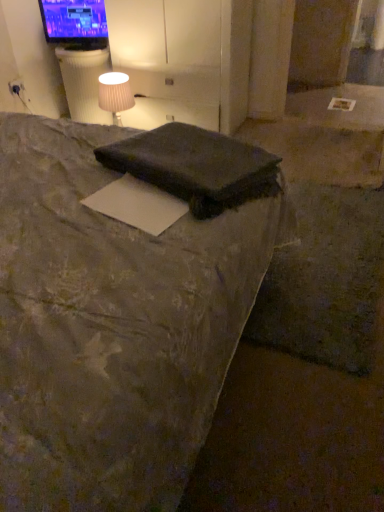
This screenshot has width=384, height=512. What do you see at coordinates (110, 328) in the screenshot? I see `dark gray fabric bed at center` at bounding box center [110, 328].

This screenshot has height=512, width=384. Find the location of `white ribbed table at upper left`. white ribbed table at upper left is located at coordinates pyautogui.click(x=84, y=82).

The height and width of the screenshot is (512, 384). Identify the location of dark gray fabric bed at center. (110, 328).

From the image's perspective, would you say dark gray fabric bed at center is positioned over white ribbed table at upper left?

Actually, dark gray fabric bed at center appears below white ribbed table at upper left in the image.

In terms of height, does dark gray fabric bed at center look taller or shorter compared to white ribbed table at upper left?

Clearly, dark gray fabric bed at center is taller compared to white ribbed table at upper left.

From a real-world perspective, which object rests below the other?

white ribbed table at upper left, from a real-world perspective.

In the image, there is a white matte paper at center. At what (x,y) coordinates should I click in order to perform the action: click on table above it (from the image's perspective). Please return your answer as a coordinate pair (x, y). Looking at the image, I should click on (84, 82).

How distant is white ribbed table at upper left from white matte paper at center?

white ribbed table at upper left and white matte paper at center are 2.12 meters apart.

Is white ribbed table at upper left further to camera compared to white matte paper at center?

Yes, it is.

Is matte white outlet at upper left beside matte white fabric at upper left?

No, matte white outlet at upper left is not making contact with matte white fabric at upper left.

From a real-world perspective, does matte white outlet at upper left stand above matte white fabric at upper left?

Yes, from a real-world perspective, matte white outlet at upper left is over matte white fabric at upper left

Which point is more forward, (13, 82) or (99, 81)?

Point (99, 81)

Is matte white outlet at upper left positioned with its back to matte white fabric at upper left?

matte white outlet at upper left does not have its back to matte white fabric at upper left.

Between point (80, 114) and point (47, 7), which one is positioned in front?

The point (47, 7) is closer to the camera.

Is white ribbed table at upper left spatially inside matte black tv at upper left, or outside of it?

white ribbed table at upper left is outside matte black tv at upper left.

Is white ribbed table at upper left to the left of matte black tv at upper left from the viewer's perspective?

Incorrect, white ribbed table at upper left is not on the left side of matte black tv at upper left.

Considering the relative positions of matte black tv at upper left and white matte paper at center in the image provided, is matte black tv at upper left to the right of white matte paper at center from the viewer's perspective?

In fact, matte black tv at upper left is to the left of white matte paper at center.

There is a white matte paper at center. Where is `television above it (from a real-world perspective)`? The height and width of the screenshot is (512, 384). television above it (from a real-world perspective) is located at coordinates (75, 23).

From a real-world perspective, does matte black tv at upper left sit lower than white matte paper at center?

Actually, matte black tv at upper left is physically above white matte paper at center in the real world.

Considering the relative sizes of dark gray fabric bed at center and white matte paper at center in the image provided, is dark gray fabric bed at center bigger than white matte paper at center?

Indeed, dark gray fabric bed at center has a larger size compared to white matte paper at center.

Are dark gray fabric bed at center and white matte paper at center making contact?

dark gray fabric bed at center is not next to white matte paper at center, and they're not touching.

Between dark gray fabric bed at center and white matte paper at center, which one appears on the right side from the viewer's perspective?

Positioned to the right is white matte paper at center.

Is dark gray fabric pillow at center bigger or smaller than dark gray fabric bed at center?

In the image, dark gray fabric pillow at center appears to be smaller than dark gray fabric bed at center.

Considering the relative positions of dark gray fabric pillow at center and dark gray fabric bed at center in the image provided, is dark gray fabric pillow at center to the left or to the right of dark gray fabric bed at center?

dark gray fabric pillow at center is positioned on dark gray fabric bed at center's right side.

Considering the positions of objects dark gray fabric pillow at center and dark gray fabric bed at center in the image provided, who is behind, dark gray fabric pillow at center or dark gray fabric bed at center?

Positioned behind is dark gray fabric pillow at center.

In terms of height, does dark gray fabric pillow at center look taller or shorter compared to dark gray fabric bed at center?

In the image, dark gray fabric pillow at center appears to be shorter than dark gray fabric bed at center.

You are a GUI agent. You are given a task and a screenshot of the screen. Output one action in this format:
    pyautogui.click(x=<x>, y=<y>)
    Task: Click on the bed lying below the white ribbed table at upper left (from the image's perspective)
    The height and width of the screenshot is (512, 384).
    Given the screenshot: What is the action you would take?
    pyautogui.click(x=110, y=328)

Locate an element on the screen. The width and height of the screenshot is (384, 512). paper on the right of white ribbed table at upper left is located at coordinates (137, 205).

Based on their spatial positions, is white matte paper at center or matte white fabric at upper left further from matte black tv at upper left?

white matte paper at center.

From the image, which object appears to be farther from matte white fabric at upper left, dark gray fabric pillow at center or matte black tv at upper left?

dark gray fabric pillow at center is further to matte white fabric at upper left.

Considering their positions, is matte white outlet at upper left positioned closer to white matte paper at center than dark gray fabric pillow at center?

Among the two, dark gray fabric pillow at center is located nearer to white matte paper at center.

Looking at the image, which one is located further to white ribbed table at upper left, matte white fabric at upper left or dark gray fabric pillow at center?

The object further to white ribbed table at upper left is dark gray fabric pillow at center.

When comparing their distances from dark gray fabric bed at center, does matte black tv at upper left or white ribbed table at upper left seem closer?

Among the two, white ribbed table at upper left is located nearer to dark gray fabric bed at center.

Looking at the image, which one is located closer to matte black tv at upper left, matte white outlet at upper left or dark gray fabric bed at center?

Among the two, matte white outlet at upper left is located nearer to matte black tv at upper left.

From the image, which object appears to be nearer to matte black tv at upper left, white ribbed table at upper left or matte white outlet at upper left?

Based on the image, white ribbed table at upper left appears to be nearer to matte black tv at upper left.

From the image, which object appears to be farther from white ribbed table at upper left, dark gray fabric pillow at center or white matte paper at center?

white matte paper at center.

You are a GUI agent. You are given a task and a screenshot of the screen. Output one action in this format:
    pyautogui.click(x=<x>, y=<y>)
    Task: Click on the table lamp between dark gray fabric bed at center and matte white outlet at upper left from front to back
    
    Given the screenshot: What is the action you would take?
    pyautogui.click(x=115, y=94)

Locate an element on the screen. This screenshot has width=384, height=512. table positioned between dark gray fabric pillow at center and matte black tv at upper left from near to far is located at coordinates (84, 82).

Where is `electric outlet positioned between dark gray fabric bed at center and matte black tv at upper left from near to far`? electric outlet positioned between dark gray fabric bed at center and matte black tv at upper left from near to far is located at coordinates (16, 86).

The width and height of the screenshot is (384, 512). Find the location of `electric outlet between white matte paper at center and matte black tv at upper left along the z-axis`. electric outlet between white matte paper at center and matte black tv at upper left along the z-axis is located at coordinates (16, 86).